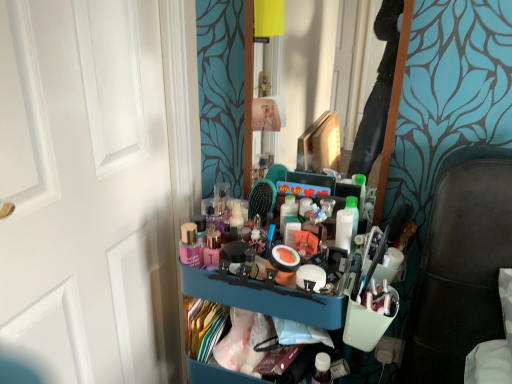
Question: Is blue plastic tray at center in front of or behind clear glass mirror at center in the image?

Choices:
 (A) front
 (B) behind

Answer: (A)

Question: Considering the positions of blue plastic tray at center and clear glass mirror at center in the image, is blue plastic tray at center taller or shorter than clear glass mirror at center?

Choices:
 (A) tall
 (B) short

Answer: (B)

Question: Which of these objects is positioned closest to the blue plastic bookshelf at center?

Choices:
 (A) white matte door at left
 (B) clear glass mirror at center
 (C) blue plastic tray at center

Answer: (C)

Question: Based on their relative distances, which object is nearer to the blue plastic bookshelf at center?

Choices:
 (A) white matte door at left
 (B) clear glass mirror at center
 (C) blue plastic tray at center

Answer: (C)